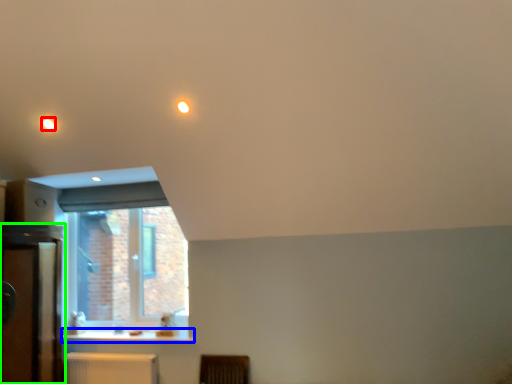
Question: Based on their relative distances, which object is nearer to lighting (highlighted by a red box)? Choose from counter top (highlighted by a blue box) and dresser (highlighted by a green box).

Choices:
 (A) counter top
 (B) dresser

Answer: (B)